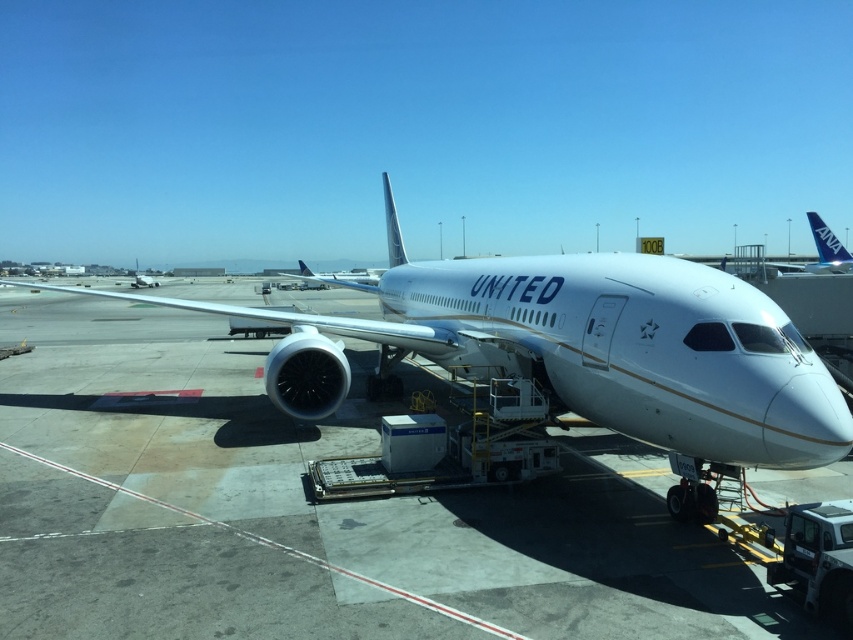
In the scene shown: How far apart are white glossy airplane at center and white matte airplane at upper left?

white glossy airplane at center is 65.12 meters away from white matte airplane at upper left.

Is white glossy airplane at center thinner than white matte airplane at upper left?

Yes, white glossy airplane at center is thinner than white matte airplane at upper left.

Image resolution: width=853 pixels, height=640 pixels. What do you see at coordinates (579, 349) in the screenshot?
I see `white glossy airplane at center` at bounding box center [579, 349].

Locate an element on the screen. white glossy airplane at center is located at coordinates (579, 349).

Between point (836, 262) and point (326, 282), which one is positioned in front?

Point (326, 282)

Who is positioned more to the left, blue metallic airplane at upper right or white matte airplane at center?

white matte airplane at center

Which is in front, point (824, 259) or point (326, 284)?

Point (326, 284) is in front.

Identify the location of blue metallic airplane at upper right. Image resolution: width=853 pixels, height=640 pixels. (817, 253).

Describe the element at coordinates (338, 278) in the screenshot. I see `white matte airplane at center` at that location.

Is white matte airplane at center below white matte airplane at upper left?

Yes.

Between point (373, 291) and point (136, 260), which one is positioned in front?

Positioned in front is point (373, 291).

Locate an element on the screen. The width and height of the screenshot is (853, 640). white matte airplane at center is located at coordinates click(338, 278).